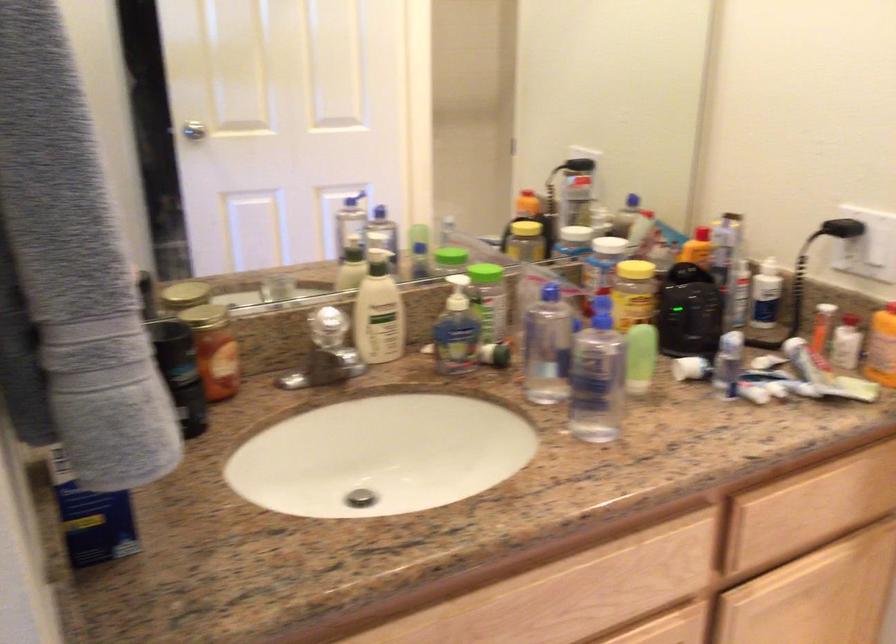
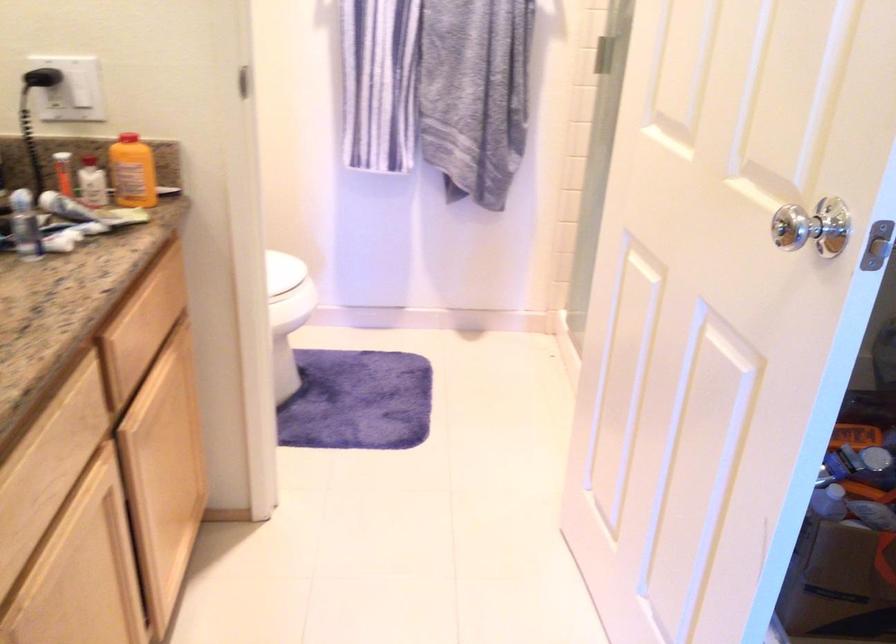
The images are taken continuously from a first-person perspective. In which direction is your viewpoint rotating?

The rotation direction of the camera is right-down.